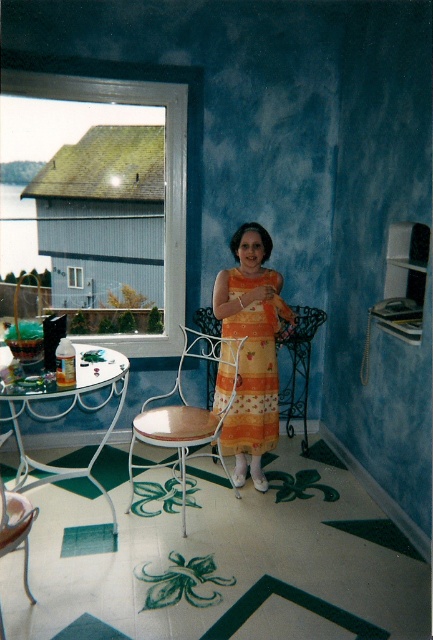
Question: Which object is closer to the camera taking this photo?

Choices:
 (A) wooden seat at center
 (B) orange printed fabric dress at center

Answer: (A)

Question: Which object appears closest to the camera in this image?

Choices:
 (A) orange printed fabric dress at center
 (B) wooden seat at center

Answer: (B)

Question: From the image, what is the correct spatial relationship of orange printed fabric dress at center in relation to wooden seat at center?

Choices:
 (A) left
 (B) right

Answer: (B)

Question: Does orange printed fabric dress at center have a greater width compared to wooden seat at center?

Choices:
 (A) no
 (B) yes

Answer: (A)

Question: Does orange printed fabric dress at center appear on the right side of wooden seat at center?

Choices:
 (A) no
 (B) yes

Answer: (B)